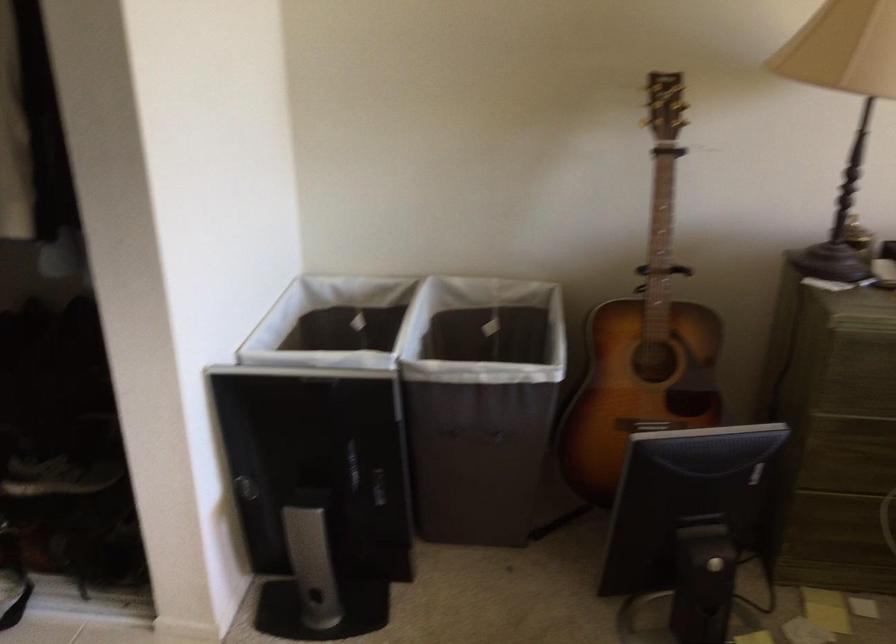
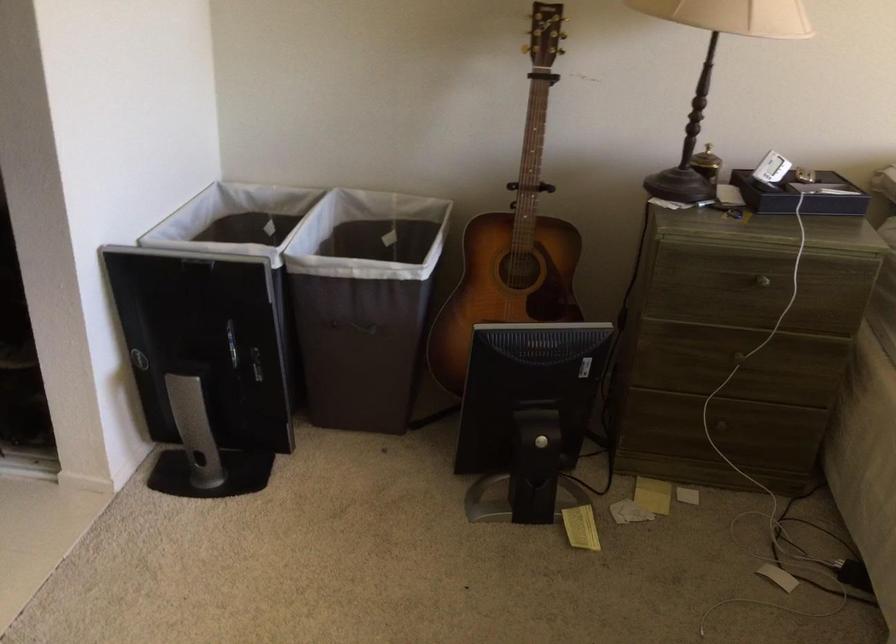
Find the pixel in the second image that matches the point at 477,438 in the first image.

(357, 327)